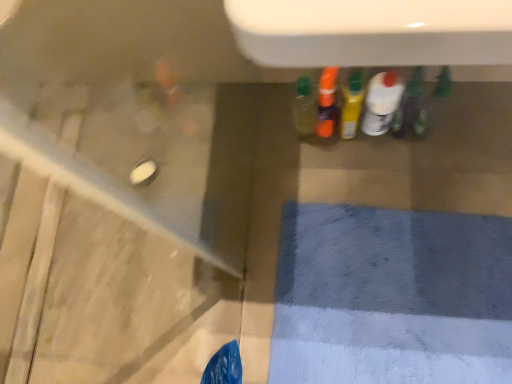
This screenshot has width=512, height=384. What are the coordinates of `vacant space to the right of green matte bottle at center, marked as the 1th bottle in a right-to-left arrangement` in the screenshot? It's located at (462, 114).